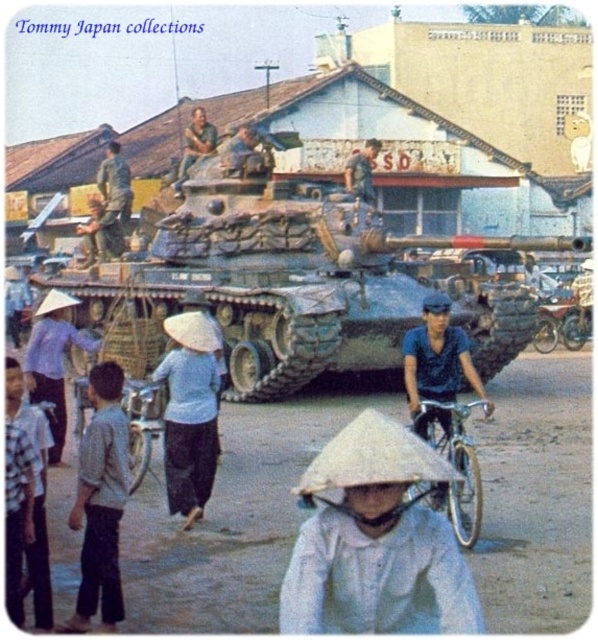
Between blue fabric shirt at center and metallic silver motorcycle at center, which one has less height?

metallic silver motorcycle at center

Is blue fabric shirt at center taller than metallic silver motorcycle at center?

Yes, blue fabric shirt at center is taller than metallic silver motorcycle at center.

At what (x,y) coordinates should I click in order to perform the action: click on blue fabric shirt at center. Please return your answer as a coordinate pair (x, y). The height and width of the screenshot is (640, 598). Looking at the image, I should click on (437, 364).

Does white cotton conical hat at center come behind camouflage fabric soldier at upper center?

No, it is in front of camouflage fabric soldier at upper center.

Between white cotton conical hat at center and camouflage fabric soldier at upper center, which one appears on the right side from the viewer's perspective?

Positioned to the right is white cotton conical hat at center.

Locate an element on the screen. white cotton conical hat at center is located at coordinates (190, 413).

Between silver metallic bicycle at lower center and camouflage fabric helmet at upper center, which one appears on the left side from the viewer's perspective?

camouflage fabric helmet at upper center

Between silver metallic bicycle at lower center and camouflage fabric helmet at upper center, which one has less height?

With less height is silver metallic bicycle at lower center.

Measure the distance between silver metallic bicycle at lower center and camera.

silver metallic bicycle at lower center and camera are 16.96 feet apart.

Identify the location of silver metallic bicycle at lower center. (456, 467).